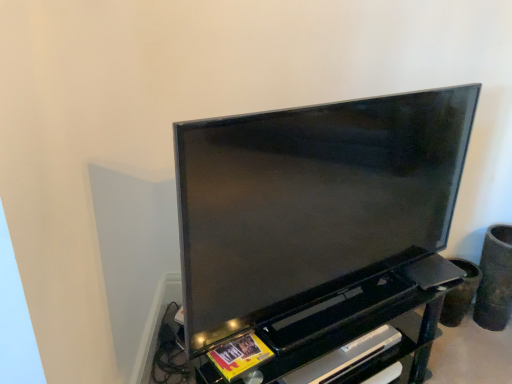
Question: From the image's perspective, is matte black tv at center above or below black plastic shelf at lower center?

Choices:
 (A) below
 (B) above

Answer: (B)

Question: Is matte black tv at center taller or shorter than black plastic shelf at lower center?

Choices:
 (A) tall
 (B) short

Answer: (A)

Question: Estimate the real-world distances between objects in this image. Which object is closer to the black glossy entertainment center at center?

Choices:
 (A) black plastic shelf at lower center
 (B) matte black tv at center

Answer: (B)

Question: Which object is positioned closest to the black glossy entertainment center at center?

Choices:
 (A) matte black tv at center
 (B) black plastic shelf at lower center

Answer: (A)